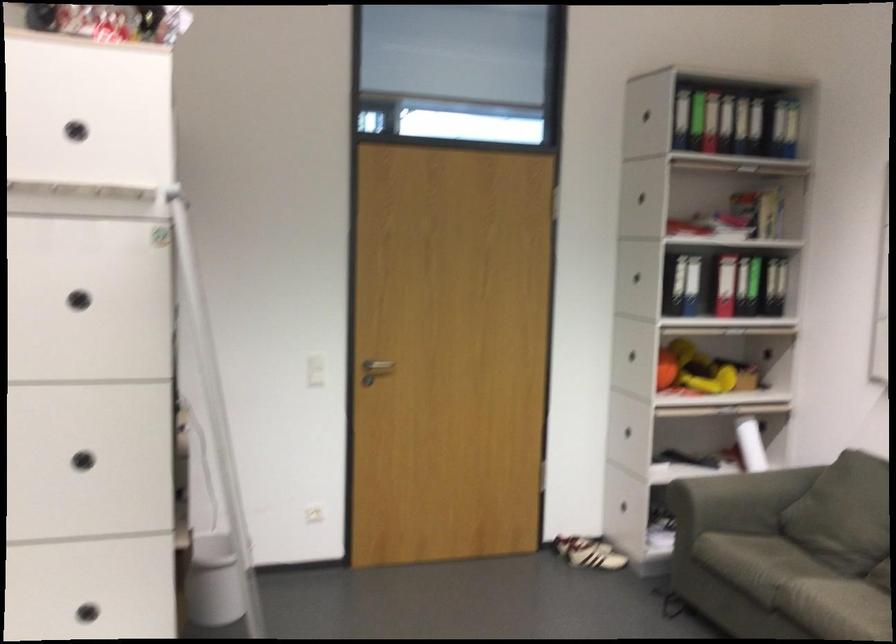
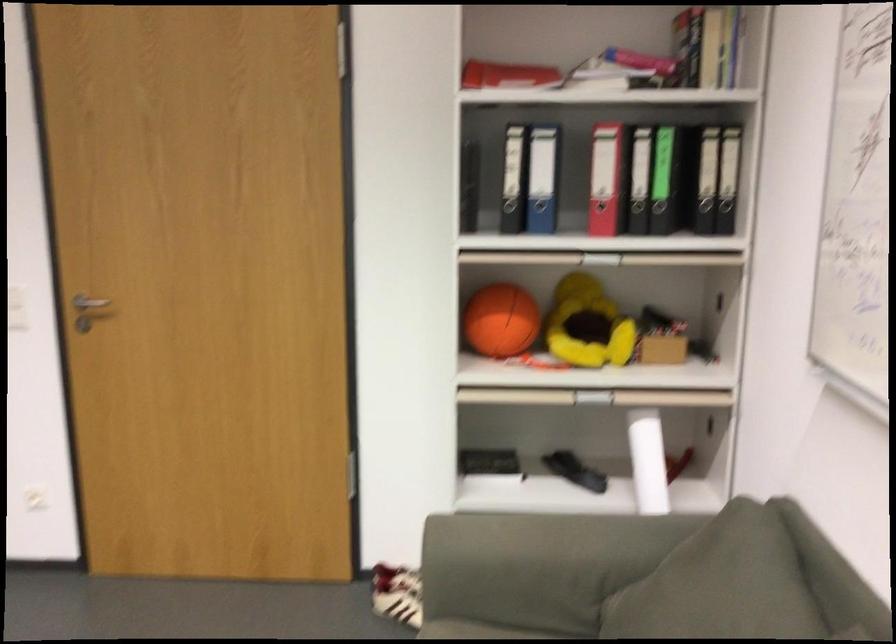
The point at (778, 337) is marked in the first image. Where is the corresponding point in the second image?

(725, 283)